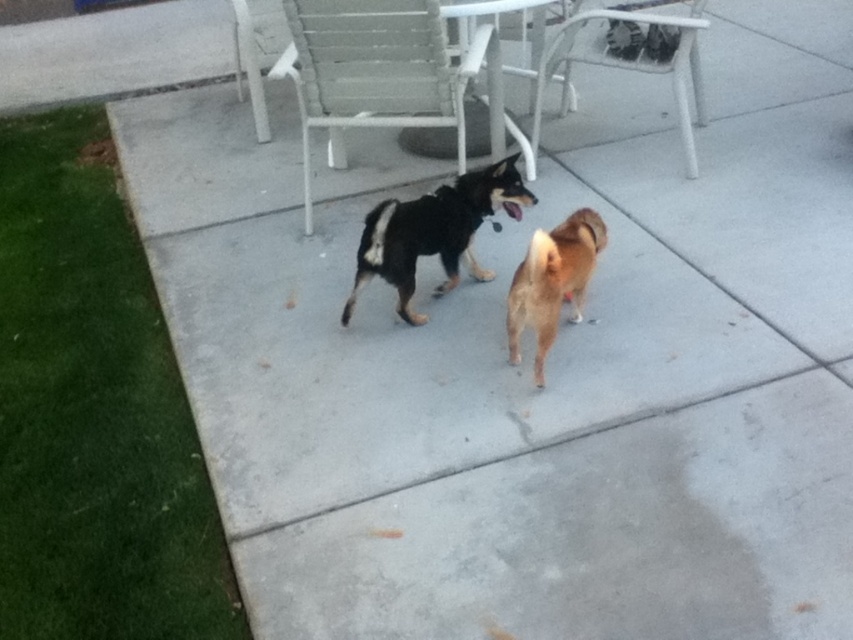
How far apart are golden brown fur at center and white plastic chair at upper center?

The distance of golden brown fur at center from white plastic chair at upper center is 1.21 meters.

Between point (515, 284) and point (532, 140), which one is positioned in front?

Point (515, 284) is in front.

This screenshot has height=640, width=853. What are the coordinates of `golden brown fur at center` in the screenshot? It's located at (552, 282).

Is point (532, 164) in front of point (544, 266)?

No, it is not.

Find the location of a particular element. The width and height of the screenshot is (853, 640). white plastic chair at center is located at coordinates (386, 76).

Consider the image. Can you confirm if black fur dog at center is wider than white plastic chair at upper center?

No.

Can you confirm if black fur dog at center is smaller than white plastic chair at upper center?

Yes.

I want to click on black fur dog at center, so click(434, 232).